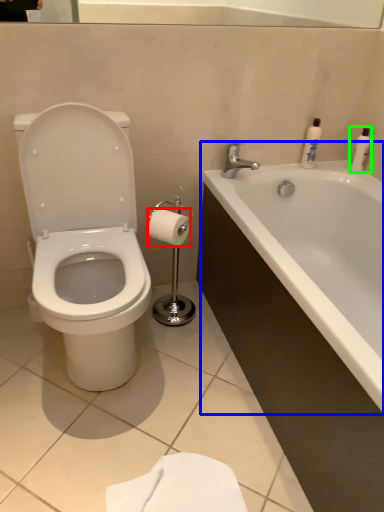
Question: Which object is the farthest from toilet paper (highlighted by a red box)? Choose among these: bathtub (highlighted by a blue box) or toiletry (highlighted by a green box).

Choices:
 (A) bathtub
 (B) toiletry

Answer: (B)